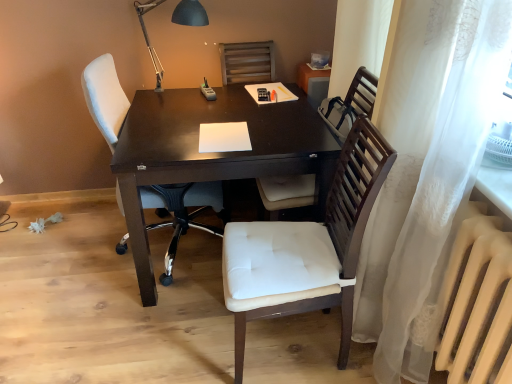
Where is `free spot in front of black metal table lamp at upper center`? The width and height of the screenshot is (512, 384). free spot in front of black metal table lamp at upper center is located at coordinates (172, 122).